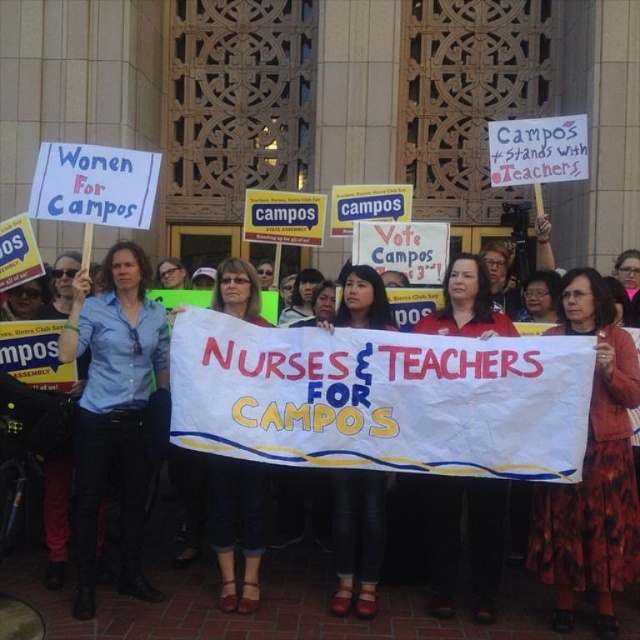
In the scene of the public demonstration in front of the institutional building, you notice a person wearing a blue shirt at center and denim pants at center. Which clothing item is shorter in length?

The blue shirt at center is shorter than the denim pants at center.

You are a photographer at the demonstration. You want to capture a photo of the denim pants at center and denim jeans at center together in the frame. If your camera has a 1.2 meter wide field of view, will both items fit side by side horizontally?

The denim pants at center is wider than the denim jeans at center. However, the combined width of both items is not specified. Without knowing their exact widths, it is impossible to determine if they fit within the 1.2 meter field of view.

Consider the image. You are a photographer at the rally and want to capture a photo of the blue shirt at center and denim jeans at center. Which object should you focus on first if you want to include both in the frame without moving the camera?

The blue shirt at center is positioned on the left side of denim jeans at center, so you should focus on the blue shirt at center first to ensure both are in frame.